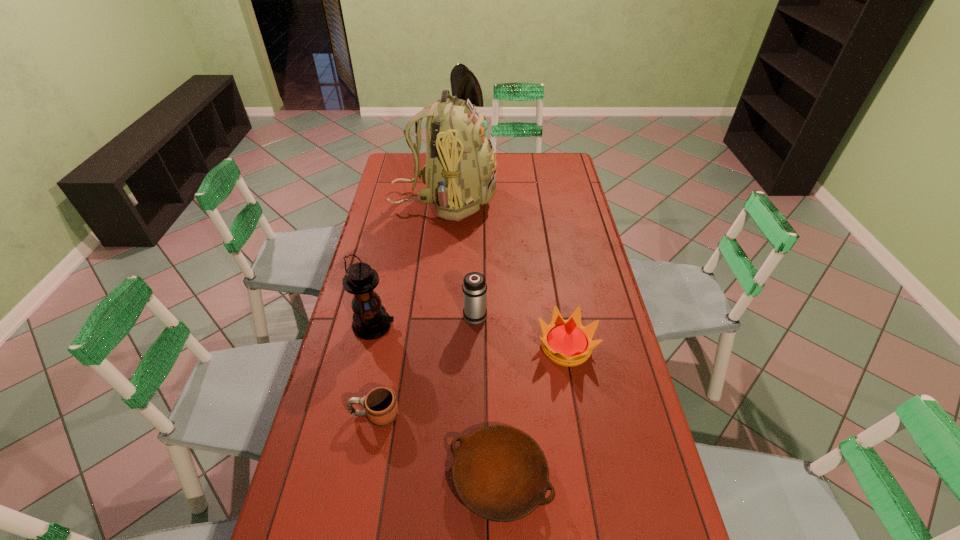
The image size is (960, 540). I want to click on free space located 0.140m on the front-facing side of the farthest object, so click(528, 200).

Identify a few spots in free region located above the second tallest object, indicating its light source. Please provide its 2D coordinates. Your answer should be formatted as a tuple, i.e. [(x, y)], where the tuple contains the x and y coordinates of a point satisfying the conditions above.

[(416, 326)]

Where is `free space located on the side with the handle of the thermos bottle`? The image size is (960, 540). free space located on the side with the handle of the thermos bottle is located at coordinates (475, 272).

Where is `vacant area located on the side with the handle of the thermos bottle`? The image size is (960, 540). vacant area located on the side with the handle of the thermos bottle is located at coordinates (x=475, y=255).

Image resolution: width=960 pixels, height=540 pixels. I want to click on free space located on the side with the handle of the thermos bottle, so click(475, 255).

This screenshot has height=540, width=960. What are the coordinates of `free region located 0.150m on the back of the crown` in the screenshot? It's located at coord(557,292).

Where is `vacant area situated 0.070m on the side of the second shortest object with the handle`? The image size is (960, 540). vacant area situated 0.070m on the side of the second shortest object with the handle is located at coordinates (325, 415).

Identify the location of vacant area located 0.280m on the back of the nearest object. This screenshot has width=960, height=540. (496, 349).

Find the location of a particular element. object that is at the far edge is located at coordinates (460, 173).

Image resolution: width=960 pixels, height=540 pixels. What are the coordinates of `backpack at the left edge` in the screenshot? It's located at (460, 173).